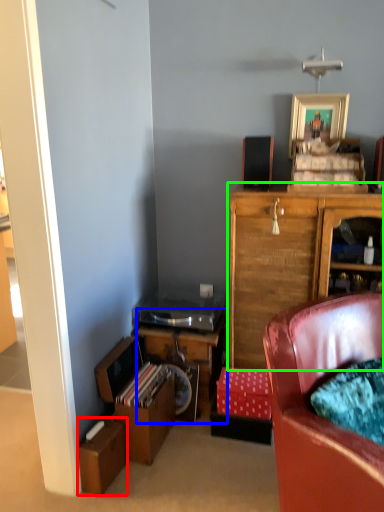
Question: Estimate the real-world distances between objects in this image. Which object is closer to cardboard box (highlighted by a red box), desk (highlighted by a blue box) or cabinetry (highlighted by a green box)?

Choices:
 (A) desk
 (B) cabinetry

Answer: (A)